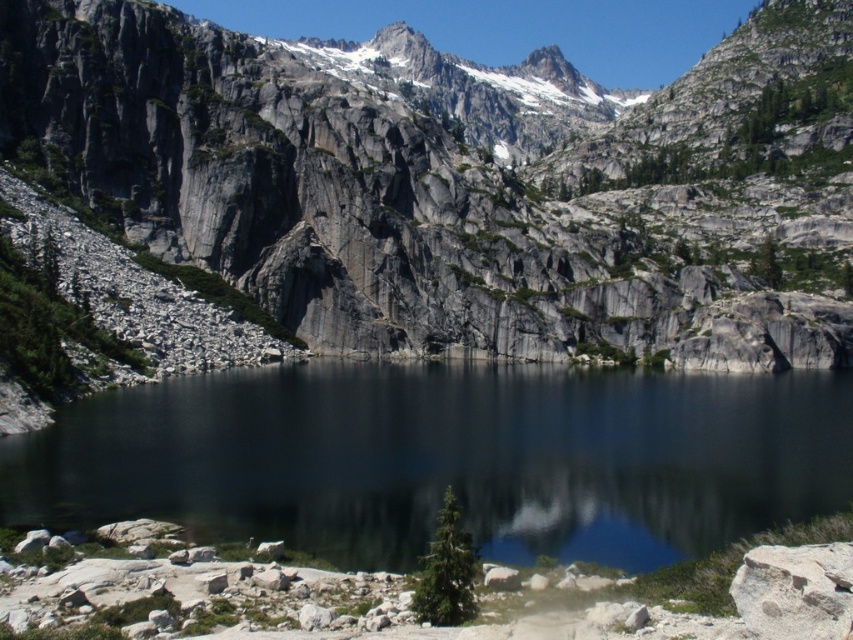
You are a hiker standing at the edge of the lake in the image. You want to reach the gray rock mountain at center. According to the coordinates provided, in which direction should you head from your current position at the lake?

The gray rock mountain at center is located at coordinates point [463,180]. Since you are at the lake, which is likely positioned lower in the image, you should head towards the center of the image where the mountain is located.

You are planning to take a photo of the gray rock mountain at center and the smooth dark water at center. Which object will appear bigger in your camera viewfinder?

The gray rock mountain at center will appear bigger in the camera viewfinder since it has a larger size compared to the smooth dark water at center.